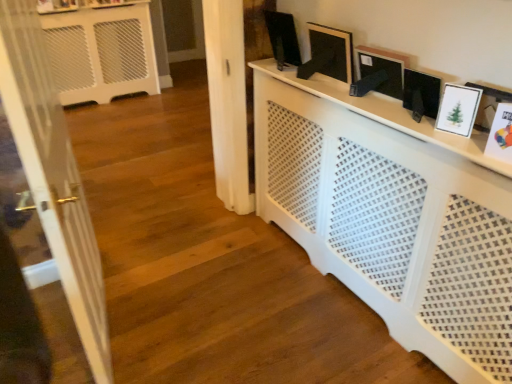
Identify the location of free location above matte black picture frame at upper center, acting as the 1th picture frame starting from the back (from a real-world perspective). The image size is (512, 384). (284, 6).